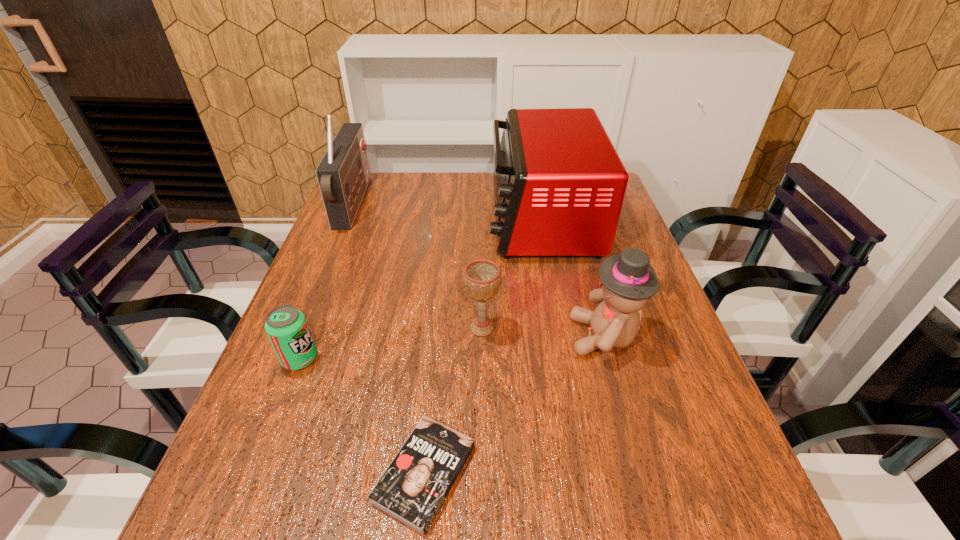
Locate an element on the screen. blank space located on the front-facing side of the toaster oven is located at coordinates (429, 219).

Locate an element on the screen. The height and width of the screenshot is (540, 960). blank area located 0.340m on the front-facing side of the rag_doll is located at coordinates (419, 336).

You are a GUI agent. You are given a task and a screenshot of the screen. Output one action in this format:
    pyautogui.click(x=<x>, y=<y>)
    Task: Click on the free space located 0.080m on the front-facing side of the rag_doll
    The height and width of the screenshot is (540, 960).
    Given the screenshot: What is the action you would take?
    pyautogui.click(x=535, y=336)

Locate an element on the screen. vacant space located on the front-facing side of the rag_doll is located at coordinates click(525, 336).

This screenshot has width=960, height=540. I want to click on free space located on the back of the third shortest object, so click(482, 234).

Identify the location of vacant area situated 0.280m on the front-facing side of the pop soda. The image size is (960, 540). (448, 359).

Where is `free space located 0.360m on the back of the shortest object`? This screenshot has height=540, width=960. free space located 0.360m on the back of the shortest object is located at coordinates (442, 292).

Identify the location of radio receiver located in the far edge section of the desktop. The width and height of the screenshot is (960, 540). (343, 174).

Where is `toaster oven that is at the far edge`? toaster oven that is at the far edge is located at coordinates (559, 185).

This screenshot has width=960, height=540. In order to click on object that is at the near edge in this screenshot , I will do `click(414, 486)`.